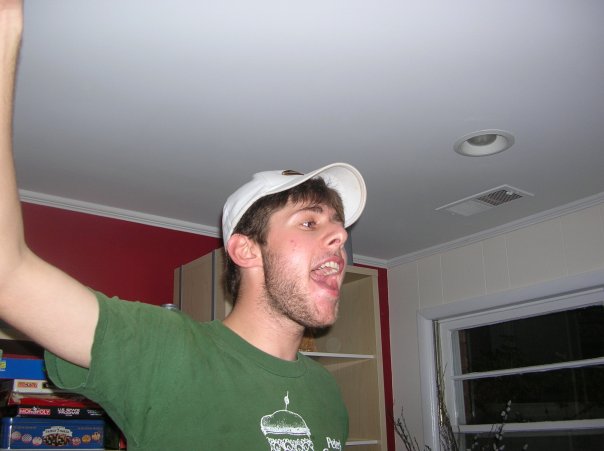
Image resolution: width=604 pixels, height=451 pixels. I want to click on windows, so click(519, 348).